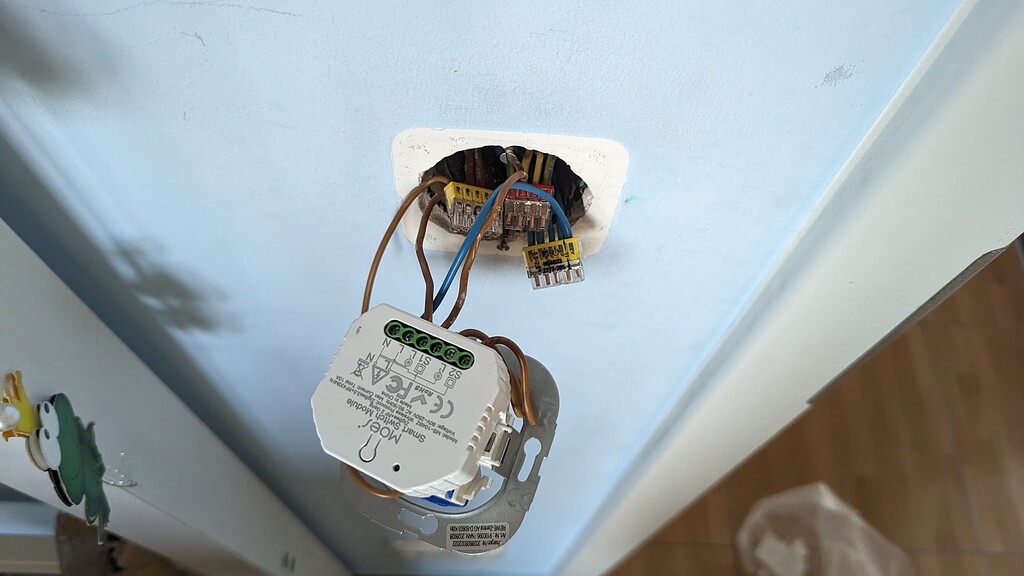
In order to click on socket in this screenshot , I will do `click(471, 193)`.